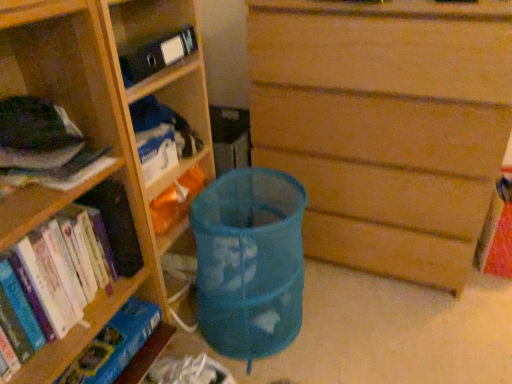
Question: From the image's perspective, is hardcover book at left, placed as the second book when sorted from bottom to top, below wooden chest of drawers at center?

Choices:
 (A) no
 (B) yes

Answer: (B)

Question: Is hardcover book at left, placed as the second book when sorted from bottom to top, closer to the viewer compared to wooden chest of drawers at center?

Choices:
 (A) yes
 (B) no

Answer: (A)

Question: Is hardcover book at left, which is the first book from top to bottom, taller than wooden chest of drawers at center?

Choices:
 (A) yes
 (B) no

Answer: (B)

Question: Is hardcover book at left, which is the first book from top to bottom, wider than wooden chest of drawers at center?

Choices:
 (A) yes
 (B) no

Answer: (B)

Question: From a real-world perspective, is hardcover book at left, which is the first book from top to bottom, positioned under wooden chest of drawers at center based on gravity?

Choices:
 (A) yes
 (B) no

Answer: (B)

Question: Is hardcover book at left, which is the first book from top to bottom, bigger or smaller than hardcover books at left, the 2th book when ordered from top to bottom?

Choices:
 (A) small
 (B) big

Answer: (A)

Question: Is hardcover book at left, placed as the second book when sorted from bottom to top, to the left or to the right of hardcover books at left, the 2th book when ordered from top to bottom, in the image?

Choices:
 (A) left
 (B) right

Answer: (B)

Question: Is point (40, 105) closer or farther from the camera than point (53, 294)?

Choices:
 (A) farther
 (B) closer

Answer: (B)

Question: Is hardcover book at left, which is the first book from top to bottom, inside or outside of hardcover books at left, the 2th book when ordered from top to bottom?

Choices:
 (A) inside
 (B) outside

Answer: (B)

Question: Is hardcover book at left, which is the first book from top to bottom, in front of or behind blue mesh bag at center in the image?

Choices:
 (A) behind
 (B) front

Answer: (B)

Question: Would you say hardcover book at left, placed as the second book when sorted from bottom to top, is inside or outside blue mesh bag at center?

Choices:
 (A) inside
 (B) outside

Answer: (B)

Question: Is hardcover book at left, which is the first book from top to bottom, wider or thinner than blue mesh bag at center?

Choices:
 (A) wide
 (B) thin

Answer: (B)

Question: From a real-world perspective, is hardcover book at left, placed as the second book when sorted from bottom to top, above or below blue mesh bag at center?

Choices:
 (A) below
 (B) above

Answer: (B)

Question: Is wooden bookshelf at left, marked as the 2th shelf in a bottom-to-top arrangement, spatially inside blue cardboard bookshelf at lower left, marked as the 2th shelf in a top-to-bottom arrangement, or outside of it?

Choices:
 (A) outside
 (B) inside

Answer: (A)

Question: Is point (74, 342) closer or farther from the camera than point (135, 304)?

Choices:
 (A) farther
 (B) closer

Answer: (B)